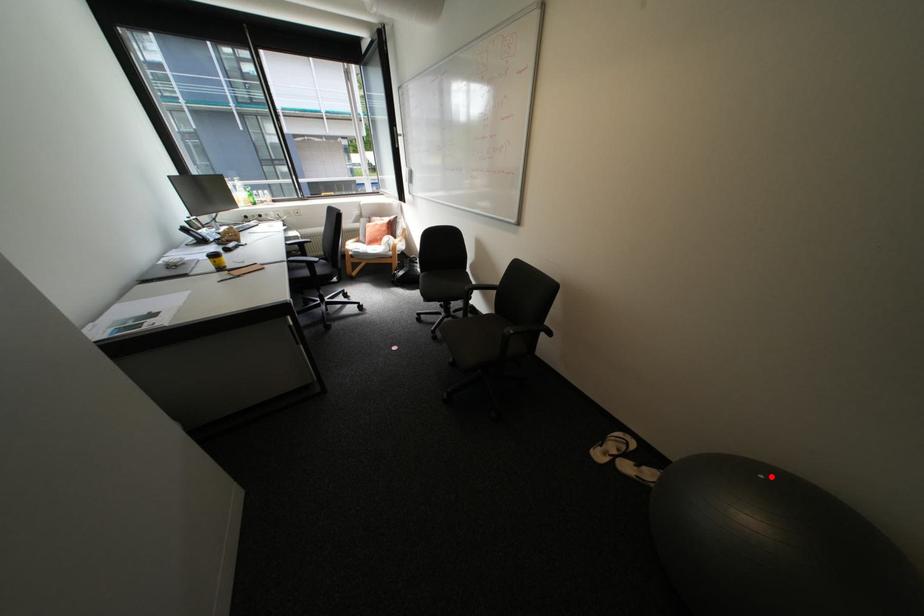
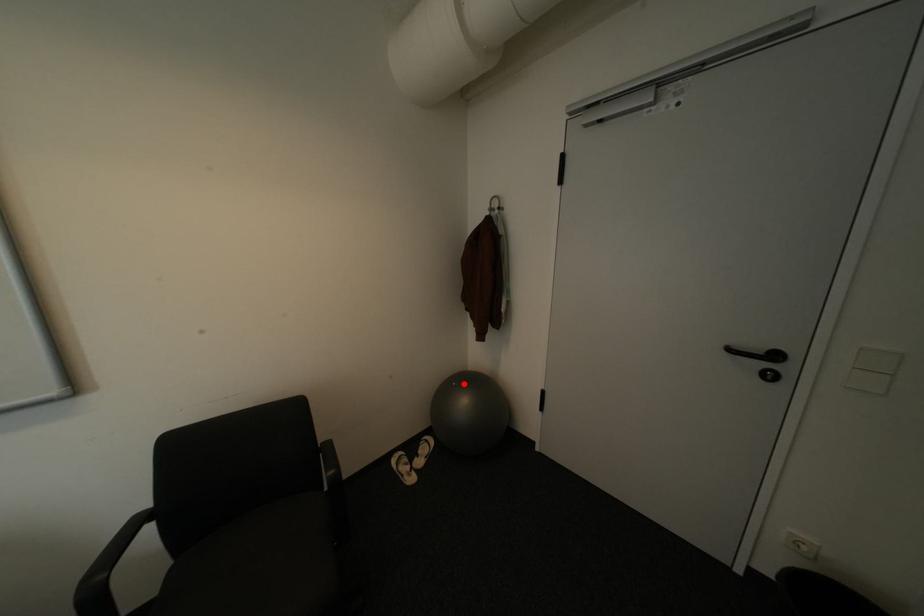
I am providing you with two images of the same scene from different viewpoints. A red point is marked on the first image and another point is marked on the second image. Does the point marked in image1 correspond to the same location as the one in image2?

Yes